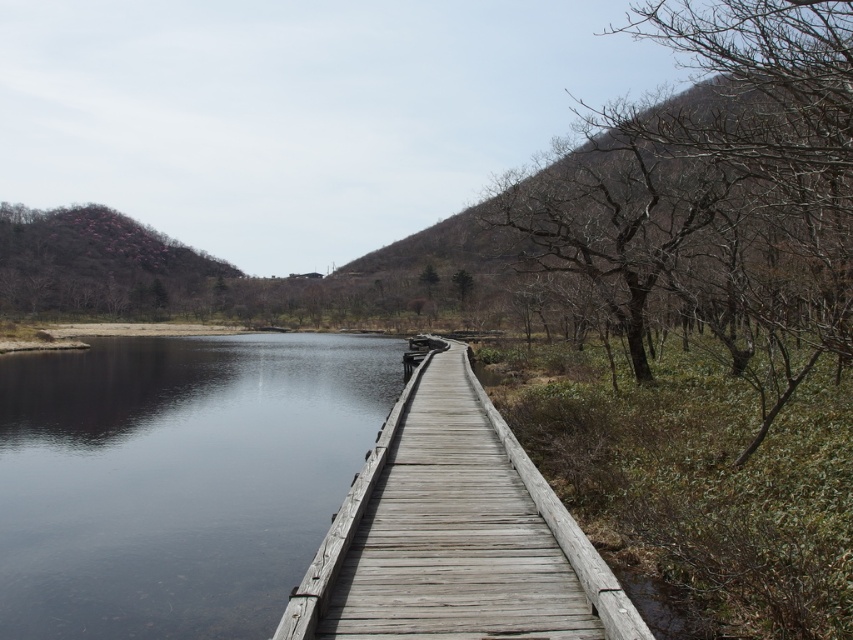
Question: Which point is closer to the camera taking this photo?

Choices:
 (A) (16, 512)
 (B) (402, 497)

Answer: (B)

Question: Which of the following is the closest to the observer?

Choices:
 (A) transparent water at center
 (B) weathered wood dock at center

Answer: (B)

Question: Is transparent water at center to the left of weathered wood dock at center from the viewer's perspective?

Choices:
 (A) yes
 (B) no

Answer: (A)

Question: Does transparent water at center have a greater width compared to weathered wood dock at center?

Choices:
 (A) no
 (B) yes

Answer: (B)

Question: From the image, what is the correct spatial relationship of transparent water at center in relation to weathered wood dock at center?

Choices:
 (A) above
 (B) below

Answer: (B)